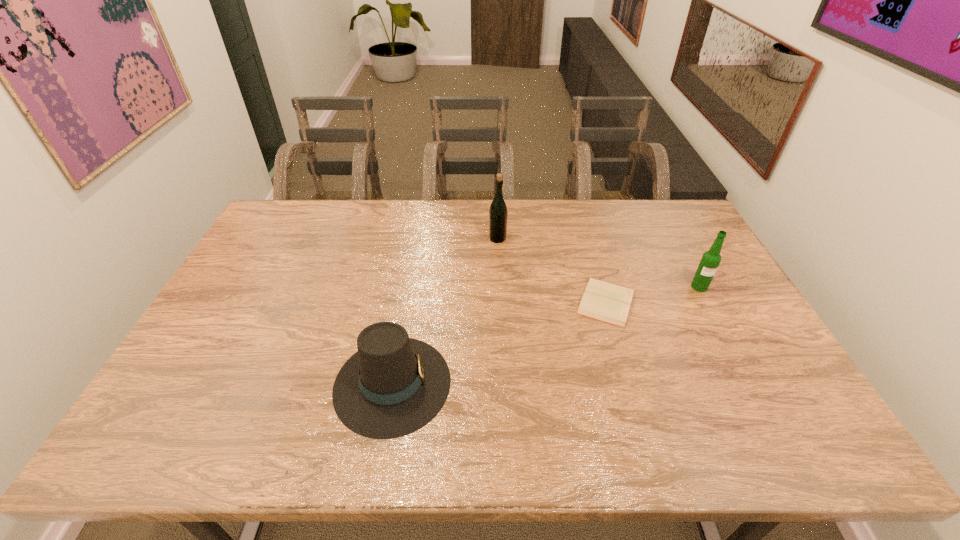
The height and width of the screenshot is (540, 960). What are the coordinates of `vacant space located 0.400m on the front-facing side of the hat` in the screenshot? It's located at (612, 383).

This screenshot has width=960, height=540. I want to click on vacant space situated on the right of the third object from left to right, so click(x=720, y=302).

Where is `object that is at the far edge`? Image resolution: width=960 pixels, height=540 pixels. object that is at the far edge is located at coordinates (498, 213).

This screenshot has width=960, height=540. I want to click on object situated at the near edge, so click(394, 385).

This screenshot has width=960, height=540. In order to click on object situated at the right edge in this screenshot , I will do `click(711, 259)`.

In order to click on vacant position at the far edge of the desktop in this screenshot , I will do `click(435, 199)`.

In the image, there is a desktop. Identify the location of vacant space at the near edge. The height and width of the screenshot is (540, 960). (524, 426).

You are a GUI agent. You are given a task and a screenshot of the screen. Output one action in this format:
    pyautogui.click(x=<x>, y=<y>)
    Task: Click on the free point at the left edge
    Image resolution: width=960 pixels, height=540 pixels.
    Given the screenshot: What is the action you would take?
    pyautogui.click(x=251, y=305)

Find the location of a particular element. vacant space at the right edge of the desktop is located at coordinates (753, 326).

At what (x,y) coordinates should I click in order to perform the action: click on vacant space at the far left corner of the desktop. Please return your answer as a coordinate pair (x, y). The width and height of the screenshot is (960, 540). Looking at the image, I should click on (272, 237).